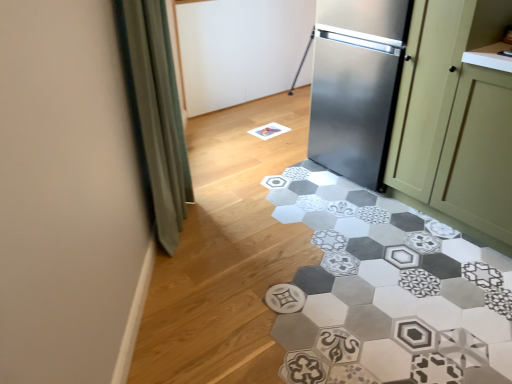
Question: Should I look upward or downward to see green fabric curtain at left?

Choices:
 (A) up
 (B) down

Answer: (A)

Question: From a real-world perspective, is stainless steel cabinet at right beneath green fabric curtain at left?

Choices:
 (A) yes
 (B) no

Answer: (A)

Question: Considering the relative sizes of stainless steel cabinet at right and green fabric curtain at left in the image provided, is stainless steel cabinet at right thinner than green fabric curtain at left?

Choices:
 (A) yes
 (B) no

Answer: (B)

Question: Is stainless steel cabinet at right positioned before green fabric curtain at left?

Choices:
 (A) no
 (B) yes

Answer: (A)

Question: Is stainless steel cabinet at right taller than green fabric curtain at left?

Choices:
 (A) no
 (B) yes

Answer: (A)

Question: Is stainless steel cabinet at right at the left side of green fabric curtain at left?

Choices:
 (A) no
 (B) yes

Answer: (A)

Question: Is green fabric curtain at left surrounded by stainless steel cabinet at right?

Choices:
 (A) no
 (B) yes

Answer: (A)

Question: From a real-world perspective, is gray hexagonal tile at center over stainless steel cabinet at right?

Choices:
 (A) no
 (B) yes

Answer: (A)

Question: Is gray hexagonal tile at center to the left of stainless steel cabinet at right from the viewer's perspective?

Choices:
 (A) yes
 (B) no

Answer: (A)

Question: From a real-world perspective, is gray hexagonal tile at center physically below stainless steel cabinet at right?

Choices:
 (A) yes
 (B) no

Answer: (A)

Question: Is gray hexagonal tile at center wider than stainless steel cabinet at right?

Choices:
 (A) no
 (B) yes

Answer: (B)

Question: Is gray hexagonal tile at center not inside stainless steel cabinet at right?

Choices:
 (A) no
 (B) yes

Answer: (B)

Question: Is stainless steel cabinet at right inside gray hexagonal tile at center?

Choices:
 (A) yes
 (B) no

Answer: (B)

Question: Could you tell me if green matte cabinet at right is facing stainless steel cabinet at right?

Choices:
 (A) no
 (B) yes

Answer: (A)